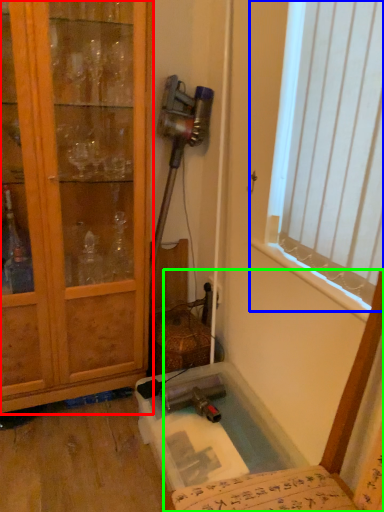
Question: Which object is positioned farthest from cabinetry (highlighted by a red box)? Select from window (highlighted by a blue box) and chair (highlighted by a green box).

Choices:
 (A) window
 (B) chair

Answer: (B)